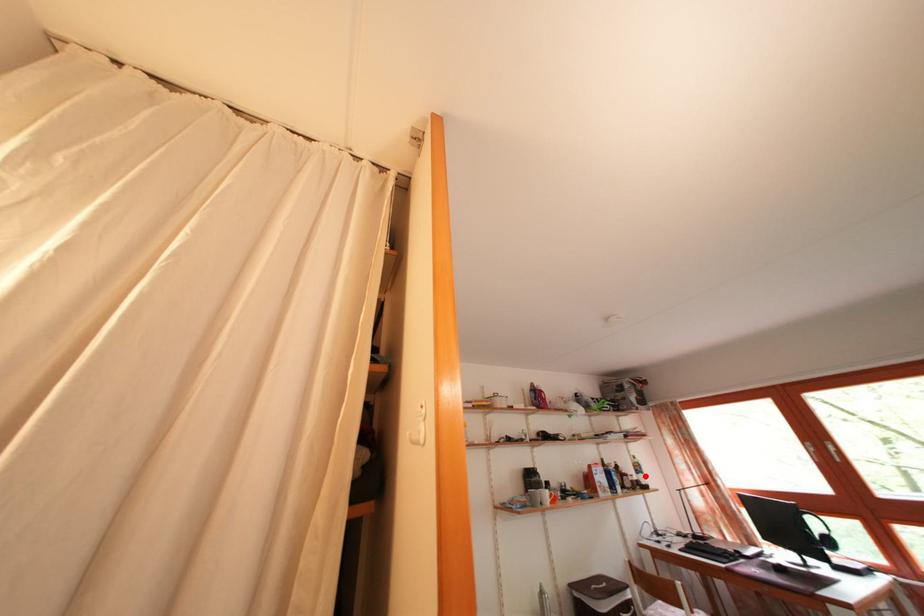
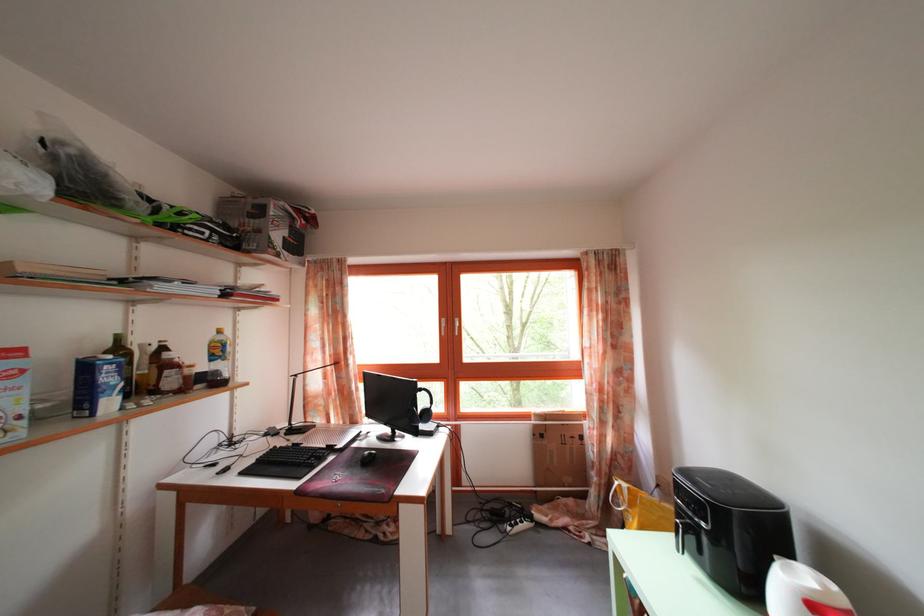
Find the pixel in the second image that matches the highlighted location in the first image.

(225, 359)